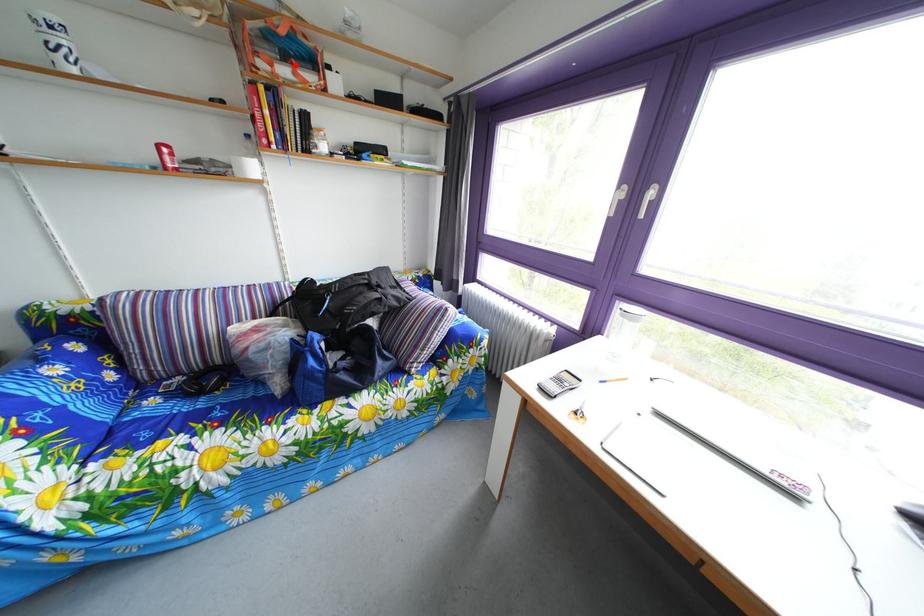
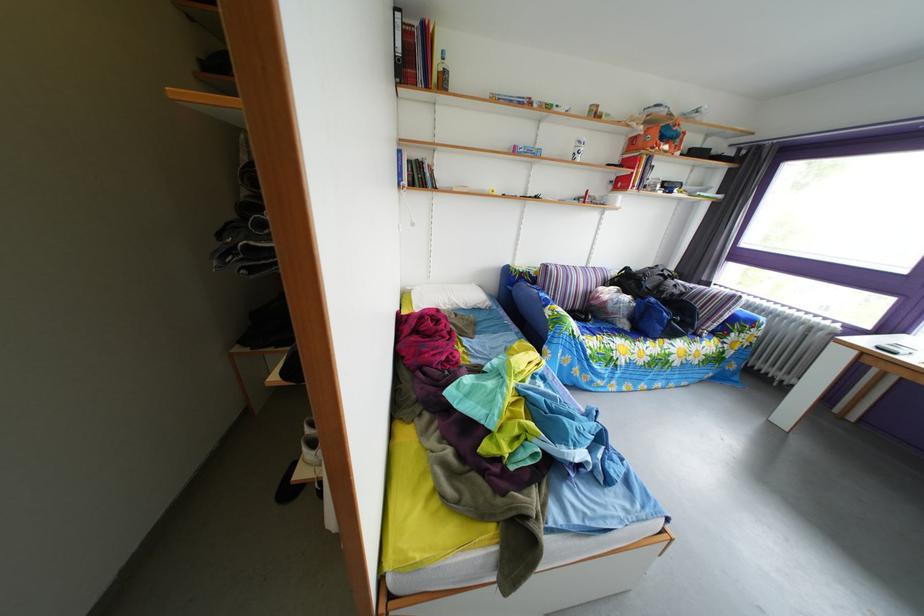
Where in the second image is the point corresponding to the highlighted location from the first image?

(673, 147)